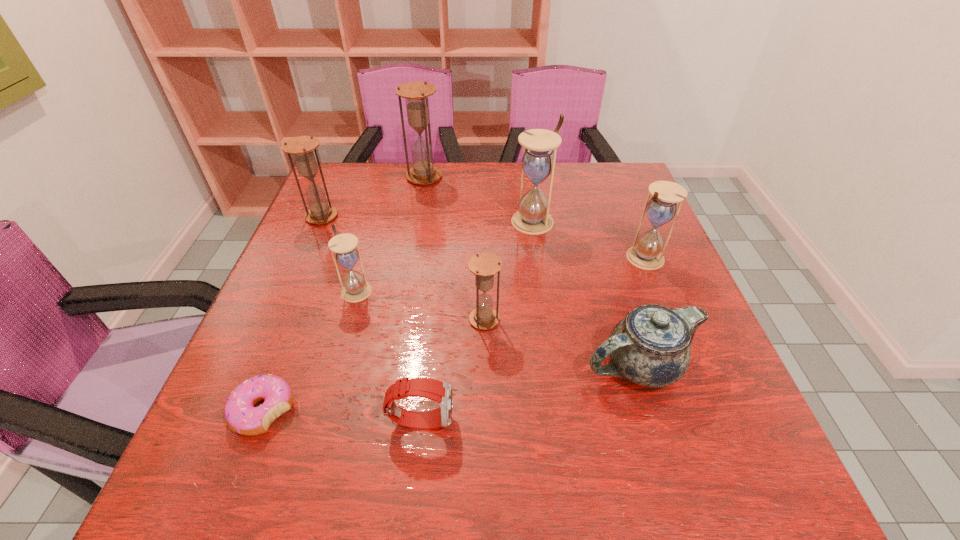
The width and height of the screenshot is (960, 540). In order to click on free location located on the back of the rightmost hourglass in this screenshot , I will do `click(620, 196)`.

You are a GUI agent. You are given a task and a screenshot of the screen. Output one action in this format:
    pyautogui.click(x=<x>, y=<y>)
    Task: Click on the vacant space located on the left of the fourth object from right to left
    
    Given the screenshot: What is the action you would take?
    pyautogui.click(x=436, y=319)

Locate an element on the screen. vacant space located 0.120m on the front of the second nearest hourglass is located at coordinates (341, 347).

You are a GUI agent. You are given a task and a screenshot of the screen. Output one action in this format:
    pyautogui.click(x=<x>, y=<y>)
    Task: Click on the vacant region located from the spout of the chinaware
    This screenshot has height=540, width=960.
    Given the screenshot: What is the action you would take?
    pyautogui.click(x=430, y=365)

Locate an element on the screen. vacant space located 0.180m from the spout of the chinaware is located at coordinates (488, 365).

Image resolution: width=960 pixels, height=540 pixels. I want to click on vacant space located 0.080m from the spout of the chinaware, so click(540, 365).

Find the location of `vacant space located on the face of the red watch`. vacant space located on the face of the red watch is located at coordinates (534, 420).

This screenshot has height=540, width=960. I want to click on free space located on the back of the shortest object, so click(x=310, y=291).

This screenshot has width=960, height=540. What are the coordinates of `doughnut that is positioned at the left edge` in the screenshot? It's located at (241, 415).

The height and width of the screenshot is (540, 960). In order to click on hourglass that is at the right edge in this screenshot , I will do `click(645, 253)`.